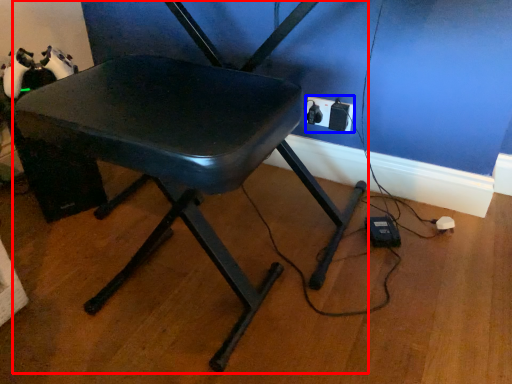
Question: Which object is further to the camera taking this photo, chair (highlighted by a red box) or electric outlet (highlighted by a blue box)?

Choices:
 (A) chair
 (B) electric outlet

Answer: (B)